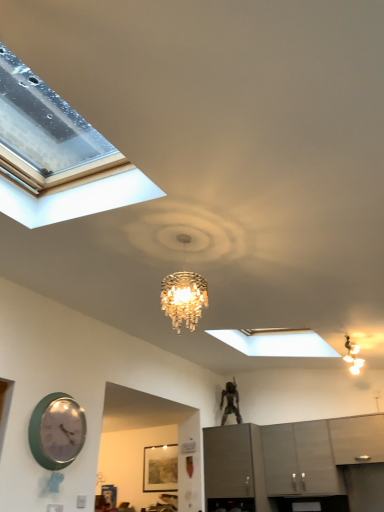
This screenshot has width=384, height=512. Describe the element at coordinates (357, 438) in the screenshot. I see `matte gray cabinet at lower right, the 1th cabinetry viewed from the right` at that location.

What do you see at coordinates (300, 459) in the screenshot? I see `satin gray cabinets at lower right, positioned as the second cabinetry in left-to-right order` at bounding box center [300, 459].

You are a GUI agent. You are given a task and a screenshot of the screen. Output one action in this format:
    pyautogui.click(x=<x>, y=<y>)
    Task: Click on the matte gray cabinet at lower right, the 3th cabinetry from the left
    This screenshot has height=512, width=384.
    Given the screenshot: What is the action you would take?
    pyautogui.click(x=357, y=438)

Is green glossy wall clock at lower left inside the boundaries of wooden textured picture frame at center, or outside?

green glossy wall clock at lower left cannot be found inside wooden textured picture frame at center.

From the image's perspective, is green glossy wall clock at lower left located above wooden textured picture frame at center?

Indeed, from the image's perspective, green glossy wall clock at lower left is shown above wooden textured picture frame at center.

Is green glossy wall clock at lower left wider than wooden textured picture frame at center?

Yes.

From the picture: Could you tell me if green glossy wall clock at lower left is facing wooden textured picture frame at center?

No, green glossy wall clock at lower left is not aimed at wooden textured picture frame at center.

Is matte gray cabinet at center, which is the 1th cabinetry from left to right, to the right of wooden textured picture frame at center from the viewer's perspective?

Correct, you'll find matte gray cabinet at center, which is the 1th cabinetry from left to right, to the right of wooden textured picture frame at center.

Considering the sizes of matte gray cabinet at center, placed as the 3th cabinetry when sorted from right to left, and wooden textured picture frame at center in the image, is matte gray cabinet at center, placed as the 3th cabinetry when sorted from right to left, wider or thinner than wooden textured picture frame at center?

matte gray cabinet at center, placed as the 3th cabinetry when sorted from right to left, is wider than wooden textured picture frame at center.

From a real-world perspective, which is physically below, matte gray cabinet at center, which is the 1th cabinetry from left to right, or wooden textured picture frame at center?

matte gray cabinet at center, which is the 1th cabinetry from left to right.

From the image's perspective, is matte gray cabinet at center, placed as the 3th cabinetry when sorted from right to left, over wooden textured picture frame at center?

Yes, from the image's perspective, matte gray cabinet at center, placed as the 3th cabinetry when sorted from right to left, is above wooden textured picture frame at center.

From a real-world perspective, is matte gray cabinet at lower right, the 1th cabinetry viewed from the right, physically located above or below satin gray cabinets at lower right, positioned as the second cabinetry in left-to-right order?

In terms of real-world spatial position, matte gray cabinet at lower right, the 1th cabinetry viewed from the right, is above satin gray cabinets at lower right, positioned as the second cabinetry in left-to-right order.

How far apart are matte gray cabinet at lower right, the 1th cabinetry viewed from the right, and satin gray cabinets at lower right, positioned as the 2th cabinetry in right-to-left order?

The distance of matte gray cabinet at lower right, the 1th cabinetry viewed from the right, from satin gray cabinets at lower right, positioned as the 2th cabinetry in right-to-left order, is 48.58 centimeters.

Is satin gray cabinets at lower right, positioned as the second cabinetry in left-to-right order, a part of matte gray cabinet at lower right, the 1th cabinetry viewed from the right?

No.

Based on the photo, considering the relative sizes of matte gray cabinet at lower right, the 1th cabinetry viewed from the right, and satin gray cabinets at lower right, positioned as the second cabinetry in left-to-right order, in the image provided, is matte gray cabinet at lower right, the 1th cabinetry viewed from the right, taller than satin gray cabinets at lower right, positioned as the second cabinetry in left-to-right order,?

No, matte gray cabinet at lower right, the 1th cabinetry viewed from the right, is not taller than satin gray cabinets at lower right, positioned as the second cabinetry in left-to-right order.

Could you tell me if matte gray cabinet at center, placed as the 3th cabinetry when sorted from right to left, is facing satin gray cabinets at lower right, positioned as the 2th cabinetry in right-to-left order?

No, matte gray cabinet at center, placed as the 3th cabinetry when sorted from right to left, is not oriented towards satin gray cabinets at lower right, positioned as the 2th cabinetry in right-to-left order.

Measure the distance from matte gray cabinet at center, which is the 1th cabinetry from left to right, to satin gray cabinets at lower right, positioned as the second cabinetry in left-to-right order.

matte gray cabinet at center, which is the 1th cabinetry from left to right, is 25.46 inches away from satin gray cabinets at lower right, positioned as the second cabinetry in left-to-right order.

Is point (220, 464) farther from viewer compared to point (294, 460)?

No, it is not.

Does matte gray cabinet at center, placed as the 3th cabinetry when sorted from right to left, have a smaller size compared to satin gray cabinets at lower right, positioned as the second cabinetry in left-to-right order?

Incorrect, matte gray cabinet at center, placed as the 3th cabinetry when sorted from right to left, is not smaller in size than satin gray cabinets at lower right, positioned as the second cabinetry in left-to-right order.

From the picture: Are matte gray cabinet at center, placed as the 3th cabinetry when sorted from right to left, and matte gray cabinet at lower right, the 3th cabinetry from the left, beside each other?

No, matte gray cabinet at center, placed as the 3th cabinetry when sorted from right to left, is not making contact with matte gray cabinet at lower right, the 3th cabinetry from the left.

From a real-world perspective, between matte gray cabinet at center, which is the 1th cabinetry from left to right, and matte gray cabinet at lower right, the 1th cabinetry viewed from the right, who is vertically lower?

In real-world perspective, matte gray cabinet at center, which is the 1th cabinetry from left to right, is lower.

Measure the distance from matte gray cabinet at center, which is the 1th cabinetry from left to right, to matte gray cabinet at lower right, the 3th cabinetry from the left.

They are 5.00 feet apart.

Which of these two, matte gray cabinet at center, which is the 1th cabinetry from left to right, or matte gray cabinet at lower right, the 1th cabinetry viewed from the right, is thinner?

matte gray cabinet at lower right, the 1th cabinetry viewed from the right, is thinner.

Find the location of `the 1st cabinetry located beneath the matte gray cabinet at lower right, the 3th cabinetry from the left (from a real-world perspective)`. the 1st cabinetry located beneath the matte gray cabinet at lower right, the 3th cabinetry from the left (from a real-world perspective) is located at coordinates (300, 459).

Is there a large distance between satin gray cabinets at lower right, positioned as the 2th cabinetry in right-to-left order, and matte gray cabinet at lower right, the 3th cabinetry from the left?

No.

From the image's perspective, is satin gray cabinets at lower right, positioned as the 2th cabinetry in right-to-left order, beneath matte gray cabinet at lower right, the 1th cabinetry viewed from the right?

Yes, from the image's perspective, satin gray cabinets at lower right, positioned as the 2th cabinetry in right-to-left order, is beneath matte gray cabinet at lower right, the 1th cabinetry viewed from the right.

Does satin gray cabinets at lower right, positioned as the second cabinetry in left-to-right order, lie behind matte gray cabinet at lower right, the 1th cabinetry viewed from the right?

Yes, satin gray cabinets at lower right, positioned as the second cabinetry in left-to-right order, is behind matte gray cabinet at lower right, the 1th cabinetry viewed from the right.

Is wooden textured picture frame at center shorter than matte gray cabinet at center, which is the 1th cabinetry from left to right?

Correct, wooden textured picture frame at center is not as tall as matte gray cabinet at center, which is the 1th cabinetry from left to right.

From a real-world perspective, which object stands above the other?

wooden textured picture frame at center, from a real-world perspective.

Does wooden textured picture frame at center turn towards matte gray cabinet at center, which is the 1th cabinetry from left to right?

No, wooden textured picture frame at center does not turn towards matte gray cabinet at center, which is the 1th cabinetry from left to right.

You are a GUI agent. You are given a task and a screenshot of the screen. Output one action in this format:
    pyautogui.click(x=<x>, y=<y>)
    Task: Click on the picture frame located underneath the green glossy wall clock at lower left (from a real-world perspective)
    Image resolution: width=384 pixels, height=512 pixels.
    Given the screenshot: What is the action you would take?
    pyautogui.click(x=160, y=468)

Which cabinetry is the 1st one when counting from the front of the wooden textured picture frame at center? Please provide its 2D coordinates.

[(228, 461)]

When comparing their distances from wooden textured picture frame at center, does satin gray cabinets at lower right, positioned as the second cabinetry in left-to-right order, or matte gray cabinet at lower right, the 1th cabinetry viewed from the right, seem closer?

Based on the image, satin gray cabinets at lower right, positioned as the second cabinetry in left-to-right order, appears to be nearer to wooden textured picture frame at center.

Which object lies further to the anchor point matte gray cabinet at lower right, the 3th cabinetry from the left, matte gray cabinet at center, which is the 1th cabinetry from left to right, or satin gray cabinets at lower right, positioned as the second cabinetry in left-to-right order?

Among the two, matte gray cabinet at center, which is the 1th cabinetry from left to right, is located further to matte gray cabinet at lower right, the 3th cabinetry from the left.

Based on their spatial positions, is matte gray cabinet at lower right, the 3th cabinetry from the left, or satin gray cabinets at lower right, positioned as the 2th cabinetry in right-to-left order, further from wooden textured picture frame at center?

matte gray cabinet at lower right, the 3th cabinetry from the left, lies further to wooden textured picture frame at center than the other object.

Estimate the real-world distances between objects in this image. Which object is closer to green glossy wall clock at lower left, wooden textured picture frame at center or satin gray cabinets at lower right, positioned as the second cabinetry in left-to-right order?

satin gray cabinets at lower right, positioned as the second cabinetry in left-to-right order, is positioned closer to the anchor green glossy wall clock at lower left.

From the image, which object appears to be nearer to green glossy wall clock at lower left, matte gray cabinet at center, placed as the 3th cabinetry when sorted from right to left, or matte gray cabinet at lower right, the 3th cabinetry from the left?

Based on the image, matte gray cabinet at center, placed as the 3th cabinetry when sorted from right to left, appears to be nearer to green glossy wall clock at lower left.

Considering their positions, is satin gray cabinets at lower right, positioned as the 2th cabinetry in right-to-left order, positioned closer to matte gray cabinet at lower right, the 1th cabinetry viewed from the right, than matte gray cabinet at center, placed as the 3th cabinetry when sorted from right to left?

satin gray cabinets at lower right, positioned as the 2th cabinetry in right-to-left order, lies closer to matte gray cabinet at lower right, the 1th cabinetry viewed from the right, than the other object.

Looking at the image, which one is located closer to satin gray cabinets at lower right, positioned as the 2th cabinetry in right-to-left order, green glossy wall clock at lower left or wooden textured picture frame at center?

Based on the image, wooden textured picture frame at center appears to be nearer to satin gray cabinets at lower right, positioned as the 2th cabinetry in right-to-left order.

Looking at this image, estimate the real-world distances between objects in this image. Which object is further from satin gray cabinets at lower right, positioned as the 2th cabinetry in right-to-left order, matte gray cabinet at center, which is the 1th cabinetry from left to right, or green glossy wall clock at lower left?

green glossy wall clock at lower left.

Where is `picture frame located between green glossy wall clock at lower left and matte gray cabinet at lower right, the 1th cabinetry viewed from the right, in the left-right direction`? The height and width of the screenshot is (512, 384). picture frame located between green glossy wall clock at lower left and matte gray cabinet at lower right, the 1th cabinetry viewed from the right, in the left-right direction is located at coordinates (160, 468).

Identify the location of cabinetry between green glossy wall clock at lower left and satin gray cabinets at lower right, positioned as the second cabinetry in left-to-right order, from left to right. This screenshot has width=384, height=512. (228, 461).

At what (x,y) coordinates should I click in order to perform the action: click on cabinetry between matte gray cabinet at center, which is the 1th cabinetry from left to right, and matte gray cabinet at lower right, the 3th cabinetry from the left. Please return your answer as a coordinate pair (x, y). The width and height of the screenshot is (384, 512). Looking at the image, I should click on (300, 459).

Locate an element on the screen. Image resolution: width=384 pixels, height=512 pixels. cabinetry between wooden textured picture frame at center and satin gray cabinets at lower right, positioned as the 2th cabinetry in right-to-left order, in the horizontal direction is located at coordinates (228, 461).